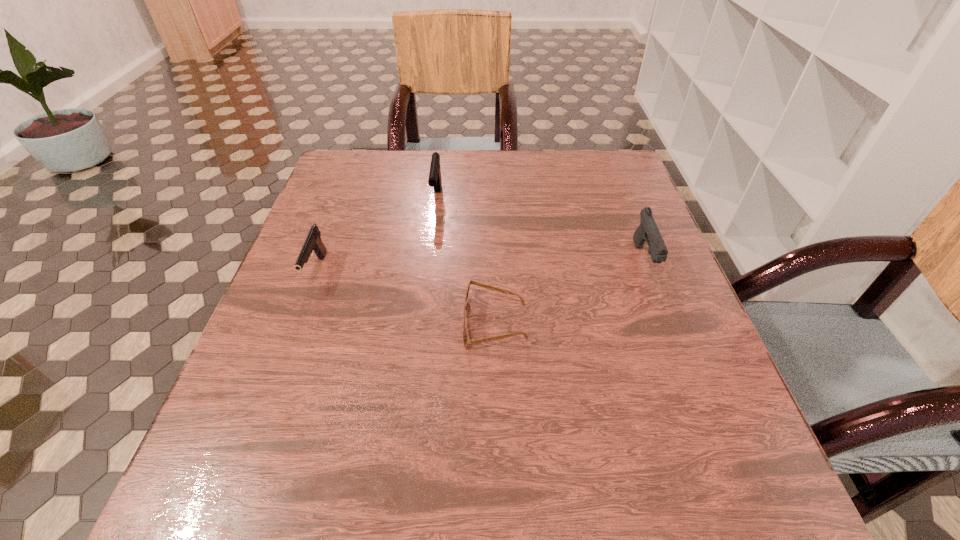
In the image, there is a desktop. Where is `vacant region at the far left corner`? Image resolution: width=960 pixels, height=540 pixels. vacant region at the far left corner is located at coordinates (369, 165).

Where is `blank space at the near left corner of the desktop`? The height and width of the screenshot is (540, 960). blank space at the near left corner of the desktop is located at coordinates (243, 517).

Where is `vacant region at the far right corner of the desktop`? The width and height of the screenshot is (960, 540). vacant region at the far right corner of the desktop is located at coordinates (585, 193).

Where is `vacant region between the shortest object and the rightmost pistol`? This screenshot has width=960, height=540. vacant region between the shortest object and the rightmost pistol is located at coordinates (569, 292).

This screenshot has height=540, width=960. Find the location of `unoccupied area between the farthest object and the rightmost pistol`. unoccupied area between the farthest object and the rightmost pistol is located at coordinates point(540,229).

Find the location of a particular element. free space between the second object from left to right and the nearest object is located at coordinates click(x=466, y=261).

Where is `free space between the second shortest object and the farthest pistol`? The height and width of the screenshot is (540, 960). free space between the second shortest object and the farthest pistol is located at coordinates (376, 235).

You are a GUI agent. You are given a task and a screenshot of the screen. Output one action in this format:
    pyautogui.click(x=<x>, y=<y>)
    Task: Click on the free space between the farthest pistol and the leftmost object
    This screenshot has height=540, width=960.
    Given the screenshot: What is the action you would take?
    pyautogui.click(x=376, y=235)

Where is `blank region between the rightmost object and the shortest object`? This screenshot has width=960, height=540. blank region between the rightmost object and the shortest object is located at coordinates (569, 292).

This screenshot has width=960, height=540. Identify the location of vacant area that lies between the rightmost pistol and the second shortest object. (480, 266).